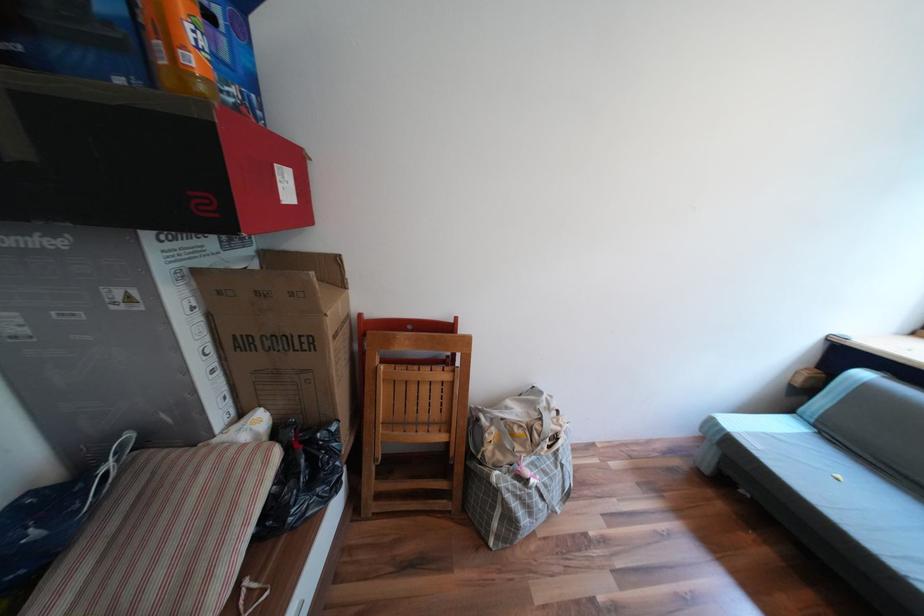
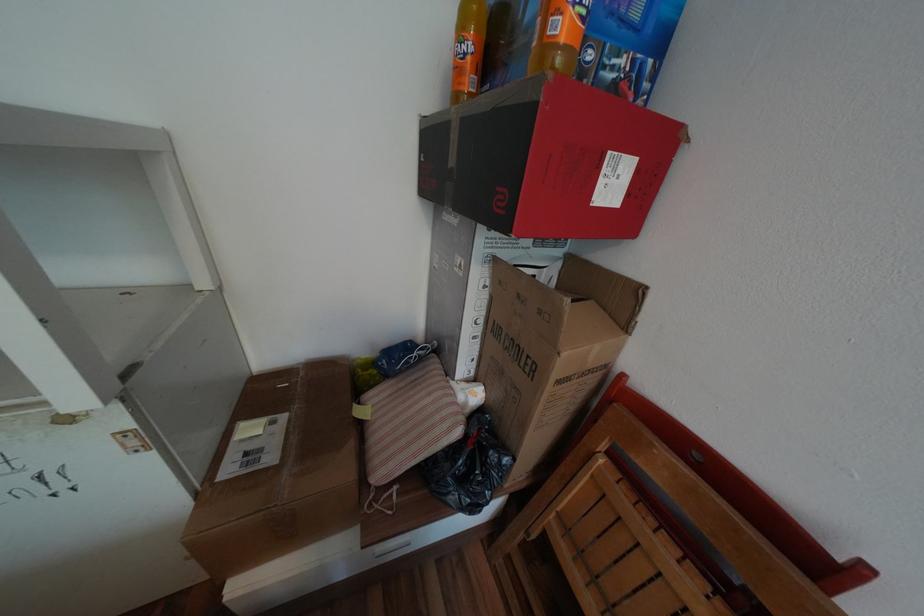
The first image is from the beginning of the video and the second image is from the end. How did the camera likely rotate when shooting the video?

The camera rotated toward left-down.